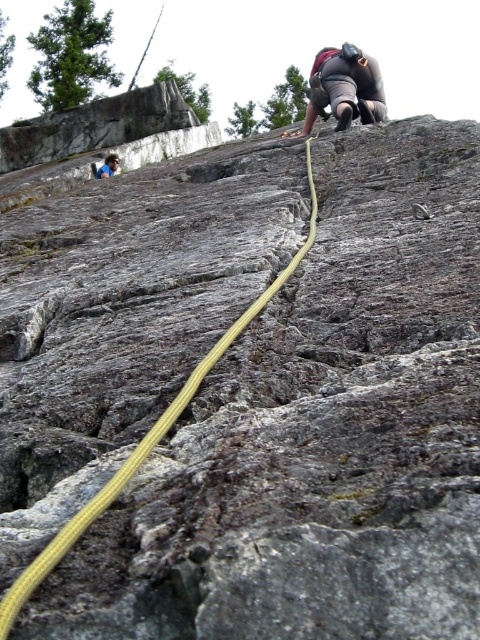
You are a hiker who wants to locate the yellow braided rope at center. From your current position, where should you look relative to the blue fabric shirt at upper left?

The yellow braided rope at center is located to the right of the blue fabric shirt at upper left.

You are a rock climber assessing the gear setup in the image. The yellow braided rope at center and the matte black harness at upper center are both visible. Which object takes up more area in the image?

The matte black harness at upper center takes up more area in the image than the yellow braided rope at center.

You are a climber assessing the safety of your route. You see the yellow braided rope at center and the blue fabric shirt at upper left. Which object is shorter in height?

The yellow braided rope at center is shorter in height than the blue fabric shirt at upper left.